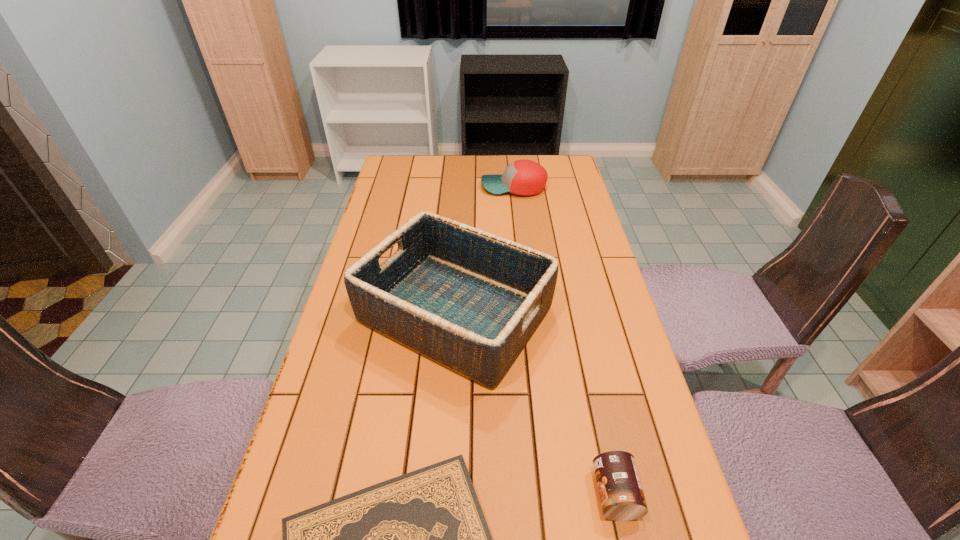
At what (x,y) coordinates should I click in order to perform the action: click on basket. Please return your answer as a coordinate pair (x, y). Image resolution: width=960 pixels, height=540 pixels. Looking at the image, I should click on (467, 299).

Locate an element on the screen. the second farthest object is located at coordinates (467, 299).

The image size is (960, 540). Identify the location of the second tallest object. (522, 177).

I want to click on the farthest object, so click(522, 177).

Identify the location of can. (621, 495).

Where is `free point located 0.060m on the right of the basket`? The width and height of the screenshot is (960, 540). free point located 0.060m on the right of the basket is located at coordinates (576, 314).

What are the coordinates of `vacant area situated 0.130m at the brim of the third shortest object` in the screenshot? It's located at (446, 187).

I want to click on vacant point located at the brim of the third shortest object, so click(x=408, y=187).

The height and width of the screenshot is (540, 960). I want to click on vacant space located 0.350m at the brim of the third shortest object, so click(x=389, y=187).

I want to click on free location located 0.400m on the front label of the third tallest object, so click(385, 494).